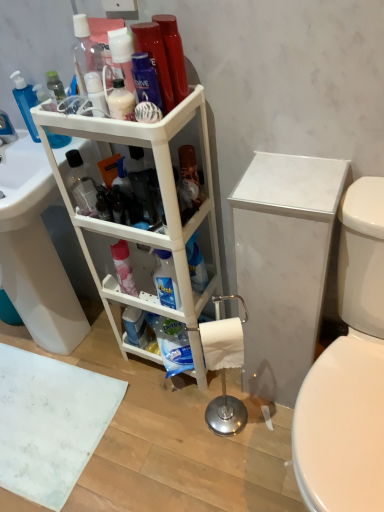
This screenshot has height=512, width=384. Identify the location of vacant point to the left of white paper towel at center. (175, 428).